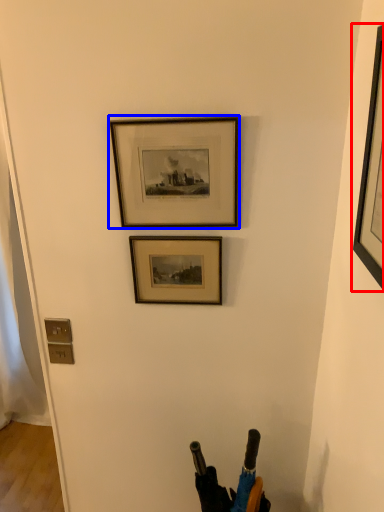
Question: Among these objects, which one is farthest to the camera, picture frame (highlighted by a red box) or picture frame (highlighted by a blue box)?

Choices:
 (A) picture frame
 (B) picture frame

Answer: (B)